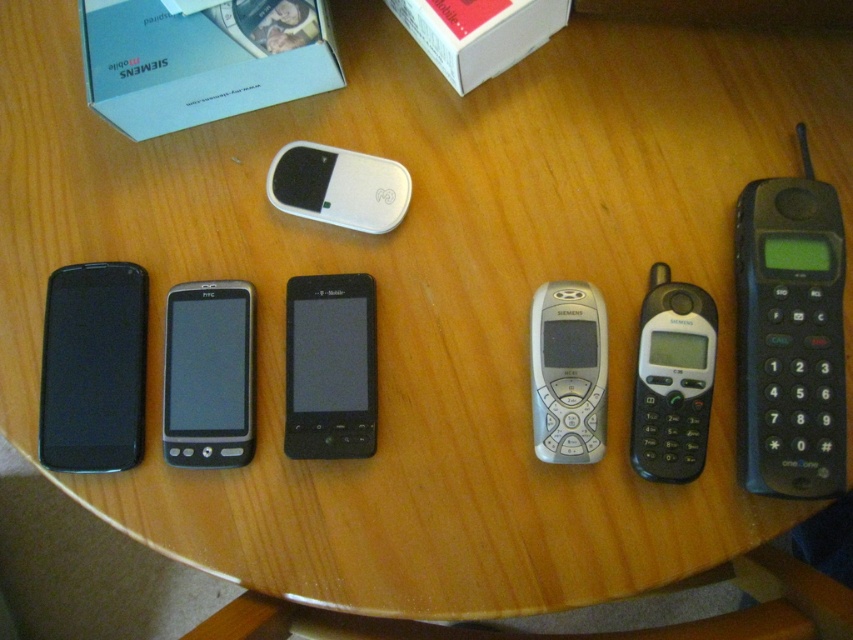
Question: Is black plastic phone at right closer to the viewer compared to white glossy mouse at center?

Choices:
 (A) no
 (B) yes

Answer: (B)

Question: Which of the following is the closest to the observer?

Choices:
 (A) black matte smartphone at left
 (B) black glossy htc phone at center

Answer: (B)

Question: Does black plastic phone at right have a smaller size compared to white cardboard box at upper left?

Choices:
 (A) yes
 (B) no

Answer: (B)

Question: Which object appears closest to the camera in this image?

Choices:
 (A) black matte smartphone at left
 (B) white cardboard box at upper left
 (C) black glossy smartphone at center

Answer: (C)

Question: Which object is closer to the camera taking this photo?

Choices:
 (A) black plastic phone at center right
 (B) black plastic phone at right
 (C) white cardboard box at upper center
 (D) black matte smartphone at left

Answer: (B)

Question: In this image, where is white cardboard box at upper left located relative to black plastic phone at center right?

Choices:
 (A) left
 (B) right

Answer: (A)